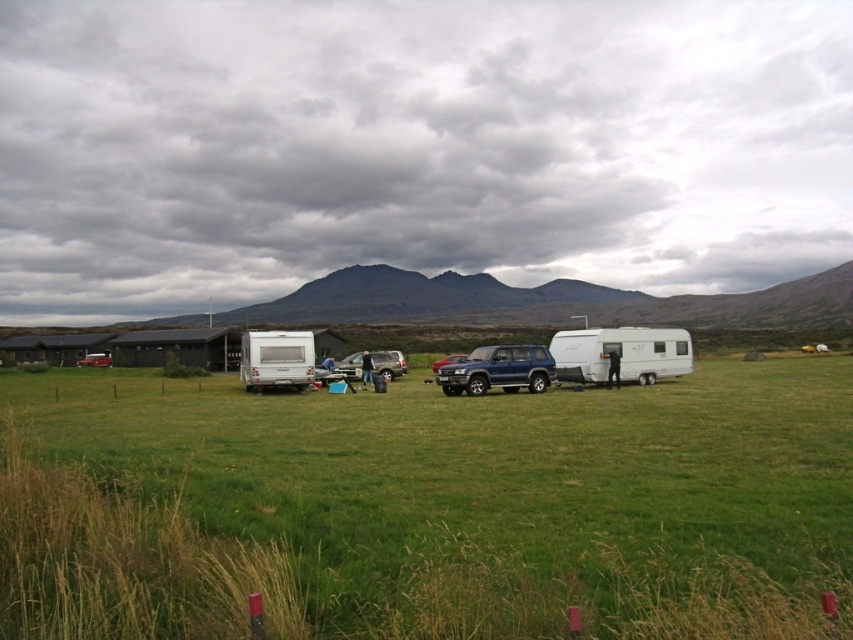
Who is positioned more to the right, white glossy trailer at right or blue metallic suv at center?

From the viewer's perspective, white glossy trailer at right appears more on the right side.

Which is in front, point (618, 348) or point (486, 348)?

Point (486, 348)

Is point (689, 349) behind point (476, 388)?

Yes, point (689, 349) is behind point (476, 388).

Where is `white glossy trailer at right`? white glossy trailer at right is located at coordinates (621, 353).

Between silver metallic camper at center-left and silver metallic van at center, which one has less height?

Standing shorter between the two is silver metallic van at center.

Does silver metallic camper at center-left have a smaller size compared to silver metallic van at center?

Actually, silver metallic camper at center-left might be larger than silver metallic van at center.

Is point (254, 349) closer to camera compared to point (344, 371)?

Yes.

The height and width of the screenshot is (640, 853). Identify the location of silver metallic camper at center-left. (276, 358).

Does blue metallic suv at center appear under silver metallic van at center?

No.

Between blue metallic suv at center and silver metallic van at center, which one appears on the left side from the viewer's perspective?

silver metallic van at center

Which is behind, point (523, 346) or point (398, 365)?

The point (398, 365) is behind.

Locate an element on the screen. This screenshot has width=853, height=640. blue metallic suv at center is located at coordinates (498, 371).